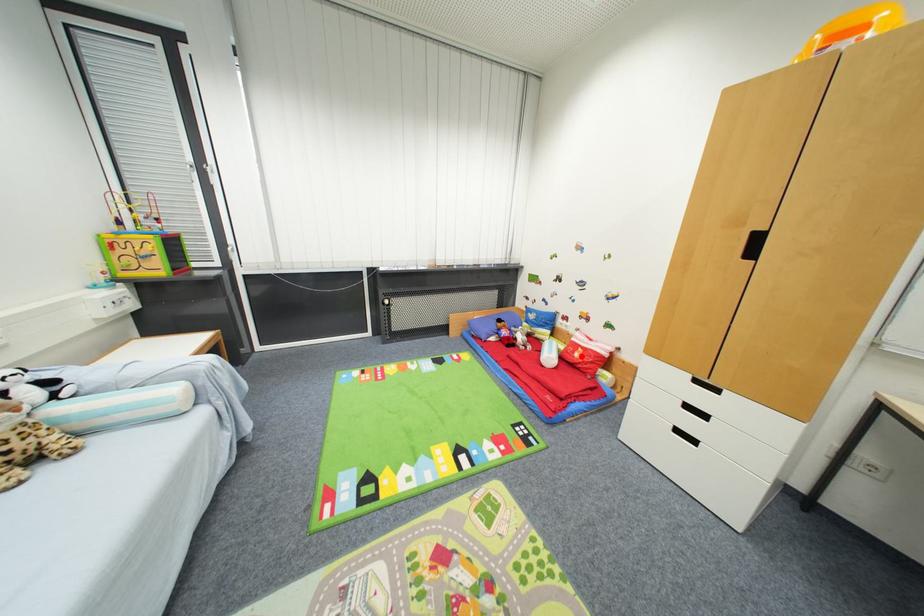
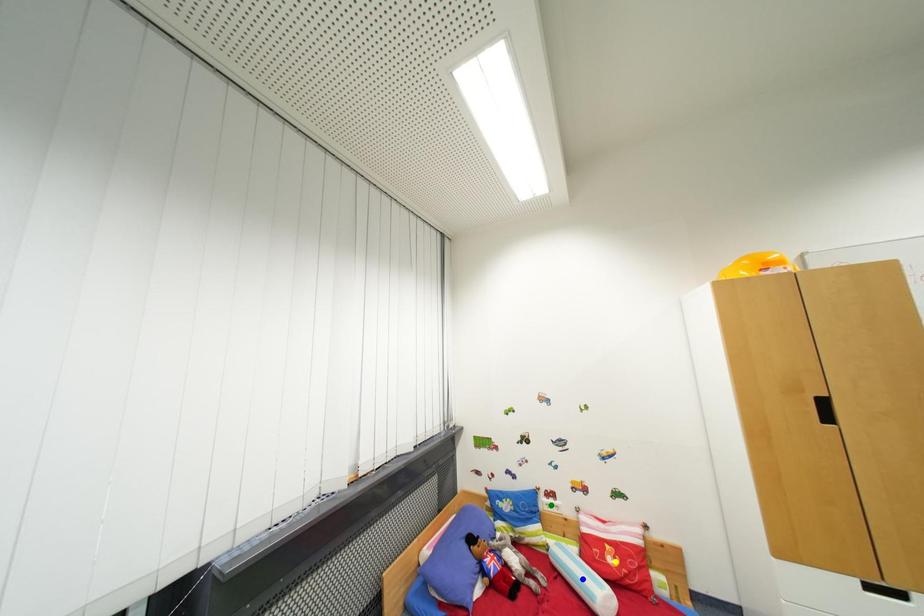
Question: I am providing you with two images of the same scene from different viewpoints. A red point is marked on the first image. You are given multiple points on the second image. Which point in image 2 is actually the same real-world point as the red point in image 1?

Choices:
 (A) blue point
 (B) yellow point
 (C) green point

Answer: (B)